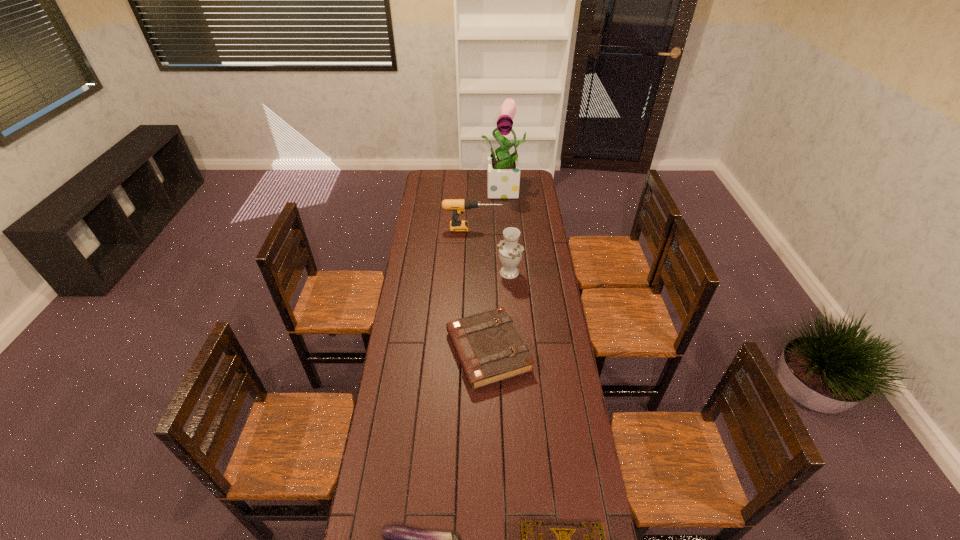
At what (x,y) coordinates should I click in order to perform the action: click on free space located 0.120m on the handle side of the fifth nearest object. Please return your answer as a coordinate pair (x, y). The height and width of the screenshot is (540, 960). Looking at the image, I should click on (523, 229).

The height and width of the screenshot is (540, 960). What are the coordinates of `free region located 0.200m on the front of the third nearest object` in the screenshot? It's located at (490, 441).

Identify the location of object present at the far edge. (503, 174).

Find the location of a particular element. flower arrangement located at the right edge is located at coordinates (503, 174).

Image resolution: width=960 pixels, height=540 pixels. Identify the location of hardback book that is at the right edge. (488, 346).

At what (x,y) coordinates should I click in order to perform the action: click on object that is at the far right corner. Please return your answer as a coordinate pair (x, y). This screenshot has width=960, height=540. Looking at the image, I should click on (503, 174).

Locate an element on the screen. vacant space at the left edge of the desktop is located at coordinates (424, 246).

Locate an element on the screen. This screenshot has height=540, width=960. vacant space at the right edge is located at coordinates (527, 259).

I want to click on free space at the far right corner of the desktop, so click(x=522, y=173).

You are a GUI agent. You are given a task and a screenshot of the screen. Output one action in this format:
    pyautogui.click(x=<x>, y=<y>)
    Task: Click on the unoccupied position between the flower arrangement and the third tallest object
    This screenshot has height=540, width=960.
    Given the screenshot: What is the action you would take?
    pyautogui.click(x=490, y=210)